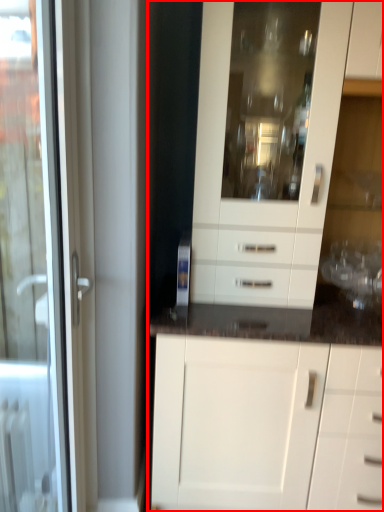
Question: Observing the image, what is the correct spatial positioning of cabinetry (annotated by the red box) in reference to door?

Choices:
 (A) left
 (B) right

Answer: (B)